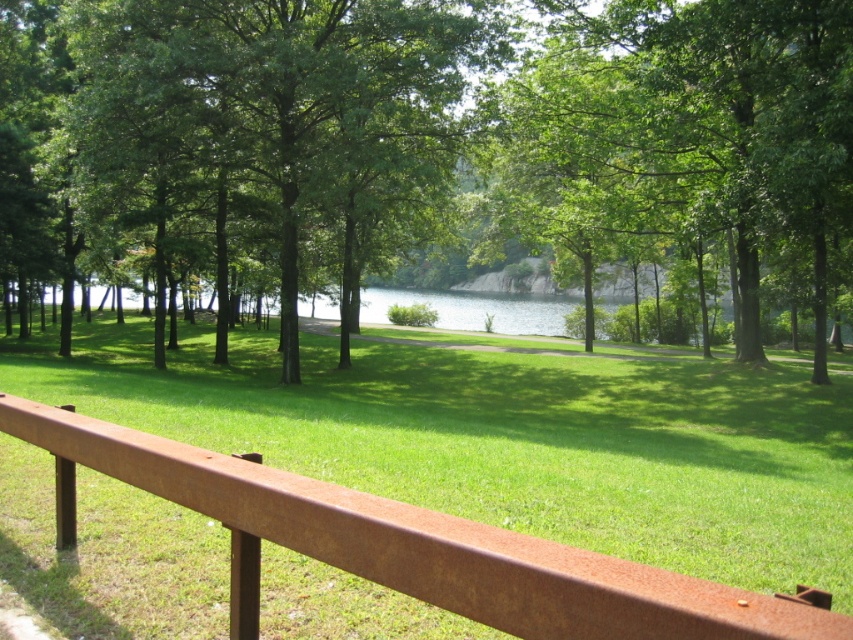
Who is taller, green leafy tree at center or rusty metal rail at center?

With more height is green leafy tree at center.

Is green leafy tree at center behind rusty metal rail at center?

That is True.

Where is `green leafy tree at center`? This screenshot has height=640, width=853. green leafy tree at center is located at coordinates (432, 148).